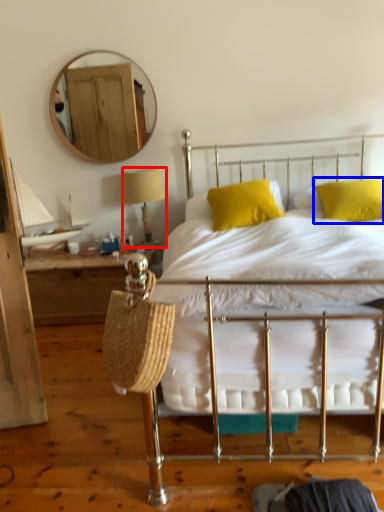
Question: Which point is further to the camera, table lamp (highlighted by a red box) or pillow (highlighted by a blue box)?

Choices:
 (A) table lamp
 (B) pillow

Answer: (A)